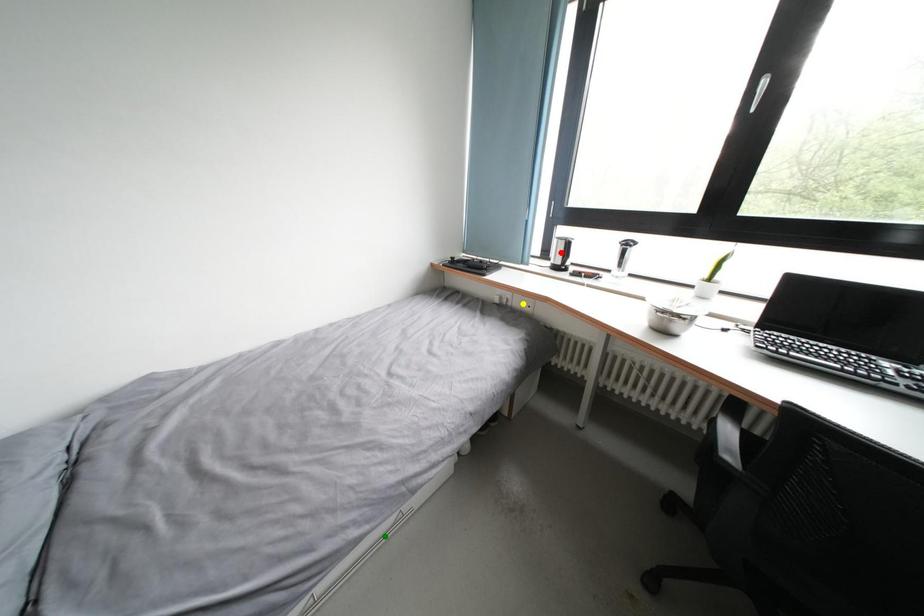
In the scene shown: Order these from nearest to farthest:
1. red point
2. green point
3. yellow point

green point < yellow point < red point